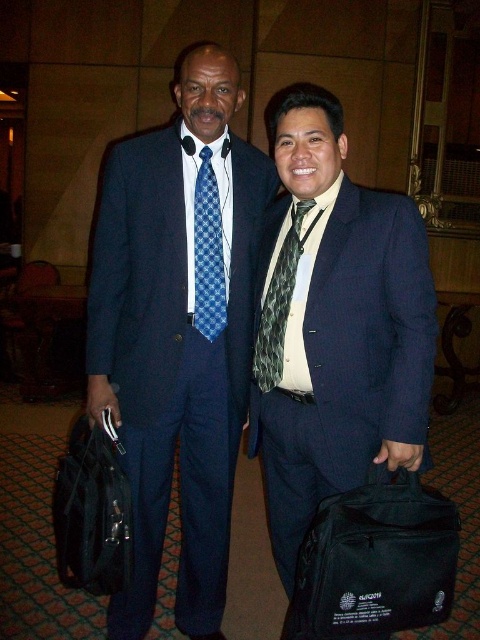
Looking at this image, you are standing at point (194, 192) and want to walk to point (144, 470). Is the destination point behind you or in front of you?

The destination point (144, 470) is behind you because it is located behind point (194, 192) where you are standing.

Consider the image. You are attending a conference and notice two men in suits. The first man has a blue checkered tie at center, and the second has a green textured tie at center. Which tie is closer to you?

The blue checkered tie at center is closer to you because the green textured tie at center is positioned behind it.